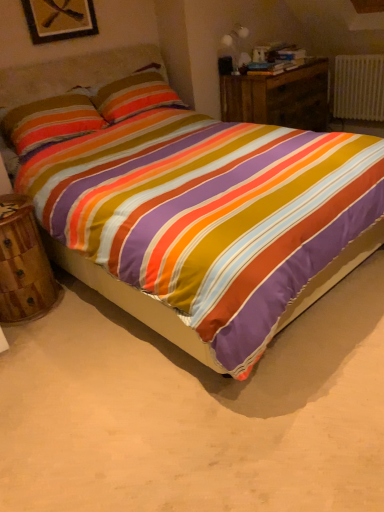
This screenshot has height=512, width=384. In order to click on wooden nightstand at center, the 1th nightstand in the top-to-bottom sequence in this screenshot , I will do `click(279, 97)`.

At what (x,y) coordinates should I click in order to perform the action: click on wooden picture frame at upper left. Please return your answer as a coordinate pair (x, y). Looking at the image, I should click on (59, 19).

Where is `textured cotton pillow at upper left`? This screenshot has width=384, height=512. textured cotton pillow at upper left is located at coordinates (50, 121).

Where is `wooden nightstand at lower left, which is the 1th nightstand from front to back`? The width and height of the screenshot is (384, 512). wooden nightstand at lower left, which is the 1th nightstand from front to back is located at coordinates (23, 264).

Find the location of `wooden nightstand at center, marked as the second nightstand in a front-to-back arrangement`. wooden nightstand at center, marked as the second nightstand in a front-to-back arrangement is located at coordinates (279, 97).

Is textured cotton pillow at upper left beside white plastic radiator at upper right?

No, textured cotton pillow at upper left is not beside white plastic radiator at upper right.

I want to click on radiator below the textured cotton pillow at upper left (from a real-world perspective), so click(359, 87).

Which of these two, textured cotton pillow at upper left or white plastic radiator at upper right, stands taller?

white plastic radiator at upper right.

Considering the relative sizes of textured cotton pillow at upper left and white plastic radiator at upper right in the image provided, is textured cotton pillow at upper left smaller than white plastic radiator at upper right?

No, textured cotton pillow at upper left is not smaller than white plastic radiator at upper right.

Is wooden picture frame at upper left turned away from wooden nightstand at lower left, positioned as the first nightstand in left-to-right order?

No.

Is wooden picture frame at upper left in front of or behind wooden nightstand at lower left, the 1th nightstand in the bottom-to-top sequence, in the image?

wooden picture frame at upper left is behind wooden nightstand at lower left, the 1th nightstand in the bottom-to-top sequence.

Where is `picture frame above the wooden nightstand at lower left, arranged as the second nightstand when viewed from the back (from a real-world perspective)`? picture frame above the wooden nightstand at lower left, arranged as the second nightstand when viewed from the back (from a real-world perspective) is located at coordinates coord(59,19).

Do you think wooden picture frame at upper left is within textured cotton pillow at upper left, or outside of it?

wooden picture frame at upper left is outside textured cotton pillow at upper left.

Are wooden picture frame at upper left and textured cotton pillow at upper left making contact?

No, wooden picture frame at upper left is not making contact with textured cotton pillow at upper left.

Which point is more distant from viewer, [49,31] or [68,105]?

The point [49,31] is behind.

Is point (263, 120) positioned in front of point (16, 295)?

No, (263, 120) is behind (16, 295).

Image resolution: width=384 pixels, height=512 pixels. In order to click on nightstand in front of the wooden nightstand at center, the second nightstand when ordered from left to right in this screenshot , I will do `click(23, 264)`.

Is wooden nightstand at center, the second nightstand when ordered from left to right, oriented towards wooden nightstand at lower left, which is the 1th nightstand from front to back?

No, wooden nightstand at center, the second nightstand when ordered from left to right, is not oriented towards wooden nightstand at lower left, which is the 1th nightstand from front to back.

Which is behind, wooden nightstand at center, the second nightstand when ordered from left to right, or wooden nightstand at lower left, the second nightstand from the right?

wooden nightstand at center, the second nightstand when ordered from left to right, is behind.

In terms of size, does white plastic radiator at upper right appear bigger or smaller than wooden nightstand at center, the 1th nightstand in the top-to-bottom sequence?

white plastic radiator at upper right is smaller than wooden nightstand at center, the 1th nightstand in the top-to-bottom sequence.

Between white plastic radiator at upper right and wooden nightstand at center, which is the second nightstand from bottom to top, which one has more height?

With more height is wooden nightstand at center, which is the second nightstand from bottom to top.

Based on the photo, from the image's perspective, which is below, white plastic radiator at upper right or wooden nightstand at center, which is the second nightstand from bottom to top?

→ wooden nightstand at center, which is the second nightstand from bottom to top, is shown below in the image.

Is white plastic radiator at upper right to the left of wooden nightstand at center, which is the first nightstand from right to left, from the viewer's perspective?

No.

Is wooden picture frame at upper left located within textured cotton pillow at upper left?

No, wooden picture frame at upper left is located outside of textured cotton pillow at upper left.

Is textured cotton pillow at upper left in contact with wooden picture frame at upper left?

No, textured cotton pillow at upper left is not next to wooden picture frame at upper left.

Between textured cotton pillow at upper left and wooden picture frame at upper left, which one has less height?

wooden picture frame at upper left.

In the image, is textured cotton pillow at upper left on the left side or the right side of wooden picture frame at upper left?

In the image, textured cotton pillow at upper left appears on the left side of wooden picture frame at upper left.

Is matte white table lamp at upper right further to the viewer compared to textured cotton pillow at upper left?

That is True.

Considering the positions of objects matte white table lamp at upper right and textured cotton pillow at upper left in the image provided, who is more to the right, matte white table lamp at upper right or textured cotton pillow at upper left?

Positioned to the right is matte white table lamp at upper right.

Would you say matte white table lamp at upper right contains textured cotton pillow at upper left?

No, textured cotton pillow at upper left is located outside of matte white table lamp at upper right.

The image size is (384, 512). I want to click on pillow that appears in front of the white plastic radiator at upper right, so click(50, 121).

Locate an element on the screen. The height and width of the screenshot is (512, 384). nightstand that is the 2nd one when counting downward from the wooden picture frame at upper left (from the image's perspective) is located at coordinates (23, 264).

Estimate the real-world distances between objects in this image. Which object is closer to matte white table lamp at upper right, white plastic radiator at upper right or textured cotton pillow at upper left?

The object closer to matte white table lamp at upper right is white plastic radiator at upper right.

Consider the image. Which object lies nearer to the anchor point wooden nightstand at lower left, which is the 2th nightstand in top-to-bottom order, textured cotton pillow at upper left or white plastic radiator at upper right?

The object closer to wooden nightstand at lower left, which is the 2th nightstand in top-to-bottom order, is textured cotton pillow at upper left.

Estimate the real-world distances between objects in this image. Which object is further from white plastic radiator at upper right, wooden picture frame at upper left or textured cotton pillow at upper left?

Based on the image, textured cotton pillow at upper left appears to be further to white plastic radiator at upper right.

Which object lies further to the anchor point textured cotton pillow at upper left, matte white table lamp at upper right or white plastic radiator at upper right?

Based on the image, white plastic radiator at upper right appears to be further to textured cotton pillow at upper left.

Estimate the real-world distances between objects in this image. Which object is further from wooden picture frame at upper left, white plastic radiator at upper right or wooden nightstand at lower left, the second nightstand from the right?

The object further to wooden picture frame at upper left is white plastic radiator at upper right.

When comparing their distances from wooden nightstand at center, marked as the second nightstand in a front-to-back arrangement, does white plastic radiator at upper right or textured cotton pillow at upper left seem closer?

white plastic radiator at upper right.

Which object lies further to the anchor point wooden nightstand at lower left, arranged as the second nightstand when viewed from the back, wooden nightstand at center, the 1th nightstand in the top-to-bottom sequence, or white plastic radiator at upper right?

white plastic radiator at upper right.

From the image, which object appears to be farther from textured cotton pillow at upper left, white plastic radiator at upper right or wooden nightstand at lower left, positioned as the first nightstand in left-to-right order?

Among the two, white plastic radiator at upper right is located further to textured cotton pillow at upper left.

Locate an element on the screen. picture frame located between wooden nightstand at lower left, the second nightstand from the right, and wooden nightstand at center, the 1th nightstand in the top-to-bottom sequence, in the left-right direction is located at coordinates (59, 19).

The width and height of the screenshot is (384, 512). Find the location of `table lamp located between wooden picture frame at upper left and white plastic radiator at upper right in the left-right direction`. table lamp located between wooden picture frame at upper left and white plastic radiator at upper right in the left-right direction is located at coordinates (236, 46).

Locate an element on the screen. picture frame located between textured cotton pillow at upper left and wooden nightstand at center, arranged as the 1th nightstand when viewed from the back, in the left-right direction is located at coordinates (59, 19).

The image size is (384, 512). I want to click on nightstand between matte white table lamp at upper right and white plastic radiator at upper right, so click(x=279, y=97).